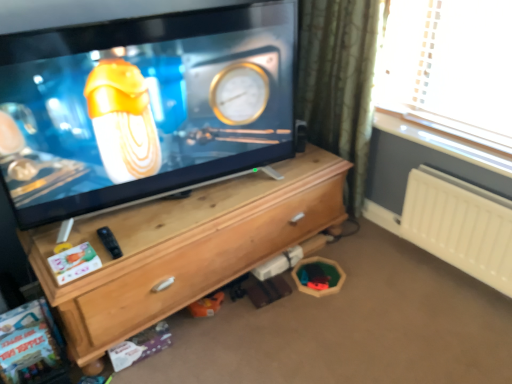
Question: Considering their positions, is white plastic radiator at right located in front of or behind wooden chest of drawers at center?

Choices:
 (A) behind
 (B) front

Answer: (A)

Question: From a real-world perspective, is white plastic radiator at right physically located above or below wooden chest of drawers at center?

Choices:
 (A) below
 (B) above

Answer: (B)

Question: Considering the real-world distances, which object is farthest from the wooden chest of drawers at center?

Choices:
 (A) green textured curtain at upper right
 (B) white plastic radiator at right
 (C) matte black tv at center

Answer: (B)

Question: Considering the real-world distances, which object is farthest from the white plastic radiator at right?

Choices:
 (A) green textured curtain at upper right
 (B) wooden chest of drawers at center
 (C) matte black tv at center

Answer: (C)